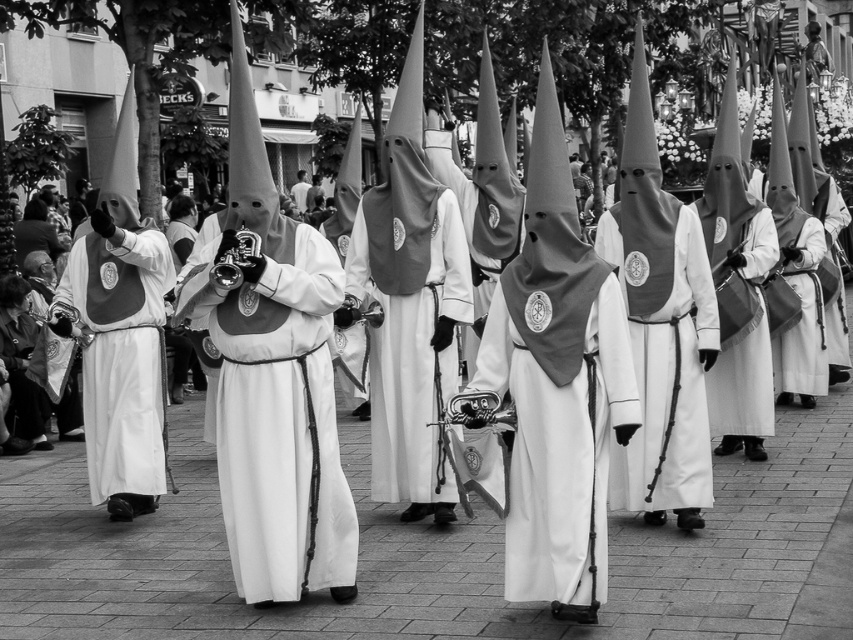
Looking at this image, does white matte uniform at center have a larger size compared to white fabric at center?

Yes, white matte uniform at center is bigger than white fabric at center.

Does white matte uniform at center have a greater height compared to white fabric at center?

Indeed, white matte uniform at center has a greater height compared to white fabric at center.

Between point (335, 512) and point (302, 189), which one is positioned in front?

Point (335, 512)

The height and width of the screenshot is (640, 853). I want to click on white matte uniform at center, so click(280, 426).

Which is behind, point (102, 312) or point (302, 202)?

The point (302, 202) is more distant.

Is white matte vest at center positioned behind white fabric at center?

No, white matte vest at center is in front of white fabric at center.

Does point (151, 272) come farther from viewer compared to point (297, 173)?

No, (151, 272) is in front of (297, 173).

Identify the location of white matte vest at center. This screenshot has height=640, width=853. (119, 353).

Between point (236, 292) and point (94, 330), which one is positioned behind?

The point (94, 330) is behind.

Who is positioned more to the left, white matte uniform at center or white matte vest at center?

Positioned to the left is white matte vest at center.

You are a GUI agent. You are given a task and a screenshot of the screen. Output one action in this format:
    pyautogui.click(x=<x>, y=<y>)
    Task: Click on the white matte uniform at center
    
    Given the screenshot: What is the action you would take?
    pyautogui.click(x=280, y=426)